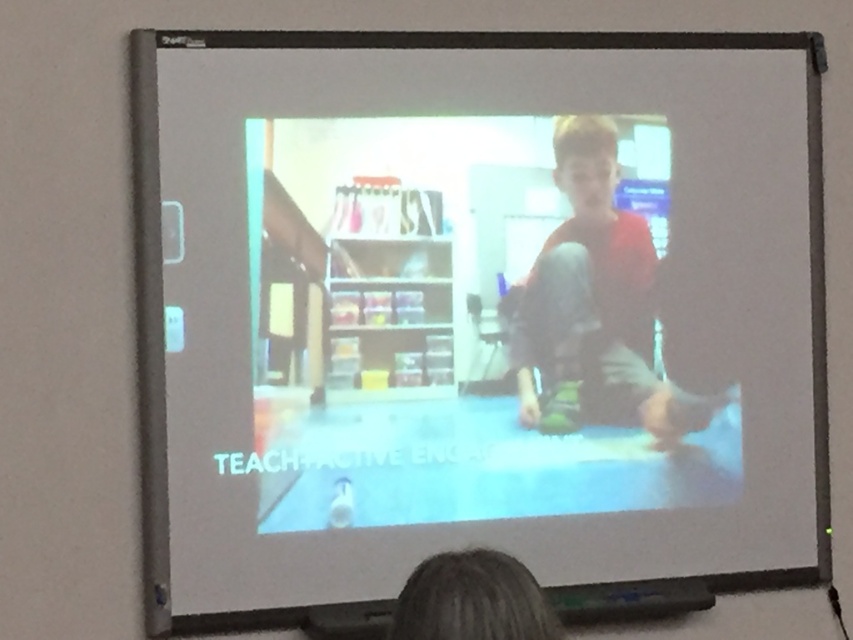
Between matte red shirt at center and blonde hair at lower center, which one appears on the left side from the viewer's perspective?

blonde hair at lower center

Does matte red shirt at center have a greater width compared to blonde hair at lower center?

Yes.

You are a GUI agent. You are given a task and a screenshot of the screen. Output one action in this format:
    pyautogui.click(x=<x>, y=<y>)
    Task: Click on the matte red shirt at center
    The image size is (853, 640).
    Given the screenshot: What is the action you would take?
    pyautogui.click(x=596, y=307)